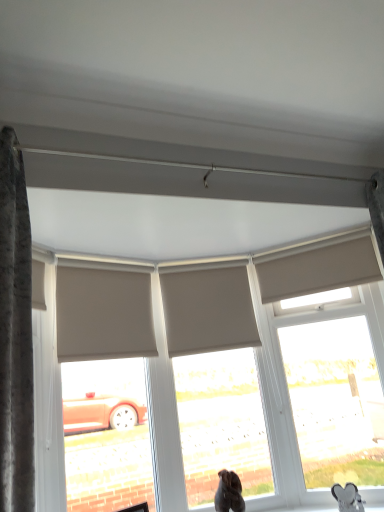
Question: From a real-world perspective, is matte gray window at center, placed as the 1th window when sorted from left to right, below brown fur dog at lower center?

Choices:
 (A) no
 (B) yes

Answer: (A)

Question: Is matte gray window at center, which appears as the 2th window when viewed from the right, closer to camera compared to brown fur dog at lower center?

Choices:
 (A) no
 (B) yes

Answer: (A)

Question: From a real-world perspective, is matte gray window at center, which appears as the 2th window when viewed from the right, on brown fur dog at lower center?

Choices:
 (A) yes
 (B) no

Answer: (A)

Question: Is brown fur dog at lower center a part of matte gray window at center, placed as the 1th window when sorted from left to right?

Choices:
 (A) no
 (B) yes

Answer: (A)

Question: Is matte gray window at center, placed as the 1th window when sorted from left to right, shorter than brown fur dog at lower center?

Choices:
 (A) no
 (B) yes

Answer: (A)

Question: Considering the positions of beige fabric shutter at upper center, the 3th shutter in the left-to-right sequence, and beige fabric shutter at center, which is the second shutter from left to right, in the image, is beige fabric shutter at upper center, the 3th shutter in the left-to-right sequence, taller or shorter than beige fabric shutter at center, which is the second shutter from left to right,?

Choices:
 (A) tall
 (B) short

Answer: (B)

Question: Does point (355, 248) appear closer or farther from the camera than point (190, 280)?

Choices:
 (A) farther
 (B) closer

Answer: (B)

Question: Looking at their shapes, would you say beige fabric shutter at upper center, which is the 1th shutter in right-to-left order, is wider or thinner than beige fabric shutter at center, which is the second shutter from left to right?

Choices:
 (A) thin
 (B) wide

Answer: (B)

Question: Is beige fabric shutter at upper center, which is the 1th shutter in right-to-left order, to the left or to the right of beige fabric shutter at center, arranged as the 2th shutter when viewed from the right, in the image?

Choices:
 (A) left
 (B) right

Answer: (B)

Question: Is point (291, 258) closer or farther from the camera than point (235, 499)?

Choices:
 (A) farther
 (B) closer

Answer: (A)

Question: From the image's perspective, relative to brown fur dog at lower center, is beige fabric shutter at upper center, which is the 1th shutter in right-to-left order, above or below?

Choices:
 (A) below
 (B) above

Answer: (B)

Question: Is beige fabric shutter at upper center, which is the 1th shutter in right-to-left order, in front of or behind brown fur dog at lower center in the image?

Choices:
 (A) behind
 (B) front

Answer: (A)

Question: Looking at their shapes, would you say beige fabric shutter at upper center, the 3th shutter in the left-to-right sequence, is wider or thinner than brown fur dog at lower center?

Choices:
 (A) wide
 (B) thin

Answer: (B)

Question: Relative to beige fabric shutter at center, which is the second shutter from left to right, is metallic silver heart-shaped object at lower right in front or behind?

Choices:
 (A) behind
 (B) front

Answer: (B)

Question: Is metallic silver heart-shaped object at lower right taller or shorter than beige fabric shutter at center, arranged as the 2th shutter when viewed from the right?

Choices:
 (A) tall
 (B) short

Answer: (B)